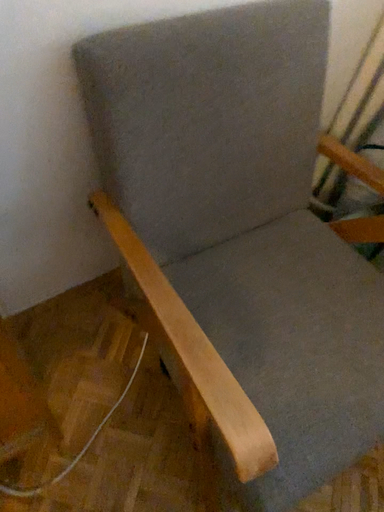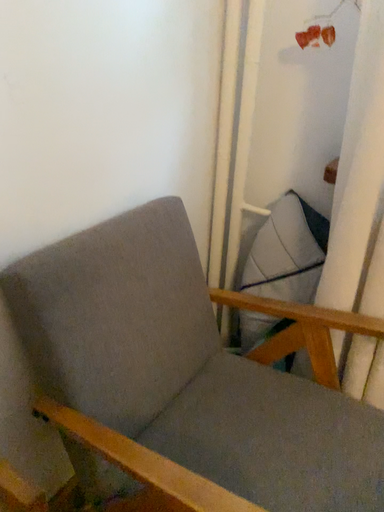
Question: Which way did the camera rotate in the video?

Choices:
 (A) rotated right
 (B) rotated left

Answer: (A)